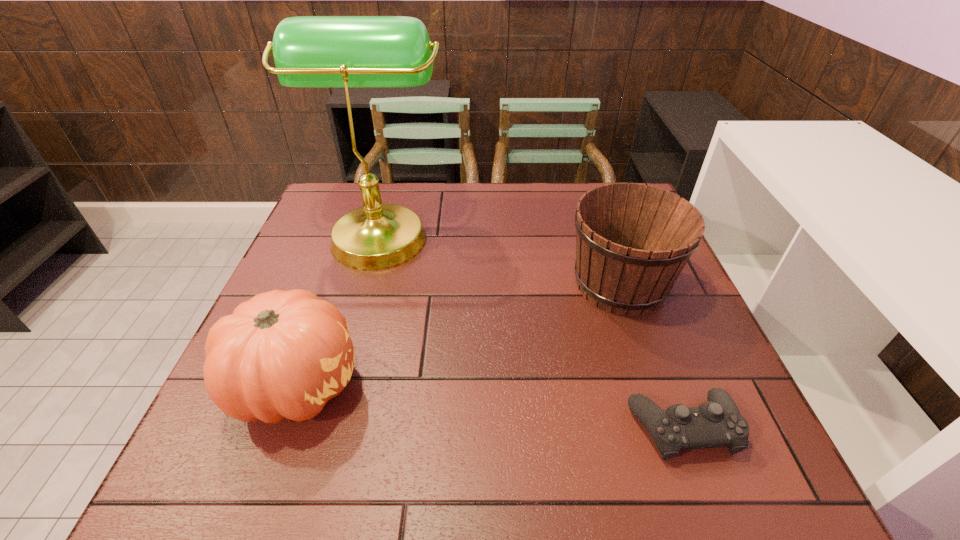
In the image, there is a desktop. At what (x,y) coordinates should I click in order to perform the action: click on free region at the far left corner. Please return your answer as a coordinate pair (x, y). This screenshot has width=960, height=540. Looking at the image, I should click on (352, 207).

Locate an element on the screen. vacant area between the wine bucket and the control is located at coordinates (652, 356).

At what (x,y) coordinates should I click in order to perform the action: click on vacant area that lies between the lamp and the wine bucket. Please return your answer as a coordinate pair (x, y). This screenshot has width=960, height=540. Looking at the image, I should click on (500, 258).

Image resolution: width=960 pixels, height=540 pixels. In order to click on vacant space in between the lamp and the pumpkin in this screenshot , I will do `click(339, 308)`.

In order to click on vacant region between the pumpkin and the shortest object in this screenshot , I will do `click(491, 406)`.

This screenshot has width=960, height=540. Identify the location of vacant point located between the pumpkin and the control. (491, 406).

The height and width of the screenshot is (540, 960). What are the coordinates of `free space between the tallest object and the wine bucket` in the screenshot? It's located at click(500, 258).

The image size is (960, 540). In order to click on vacant space in between the pumpkin and the wine bucket in this screenshot , I will do `click(459, 334)`.

Find the location of a particular element. Image resolution: width=960 pixels, height=540 pixels. vacant point located between the wine bucket and the tallest object is located at coordinates (500, 258).

This screenshot has height=540, width=960. I want to click on free point between the pumpkin and the wine bucket, so click(x=459, y=334).